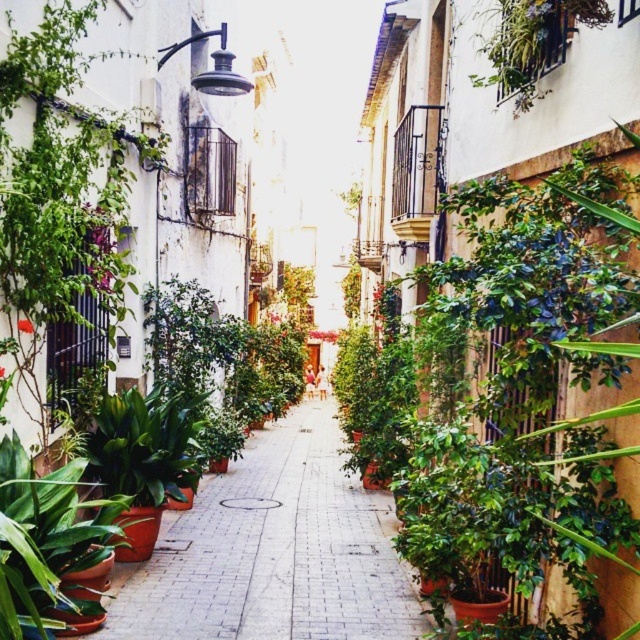
Question: Observing the image, what is the correct spatial positioning of brick pavement at center in reference to green glossy leafy plant at lower left?

Choices:
 (A) left
 (B) right

Answer: (B)

Question: Which point is farther to the camera?

Choices:
 (A) brick pavement at center
 (B) green glossy leafy plant at lower left

Answer: (A)

Question: Which point appears farthest from the camera in this image?

Choices:
 (A) (228, 637)
 (B) (45, 492)

Answer: (A)

Question: Does brick pavement at center have a larger size compared to green glossy leafy plant at lower left?

Choices:
 (A) no
 (B) yes

Answer: (B)

Question: Does brick pavement at center have a lesser width compared to green glossy leafy plant at lower left?

Choices:
 (A) yes
 (B) no

Answer: (B)